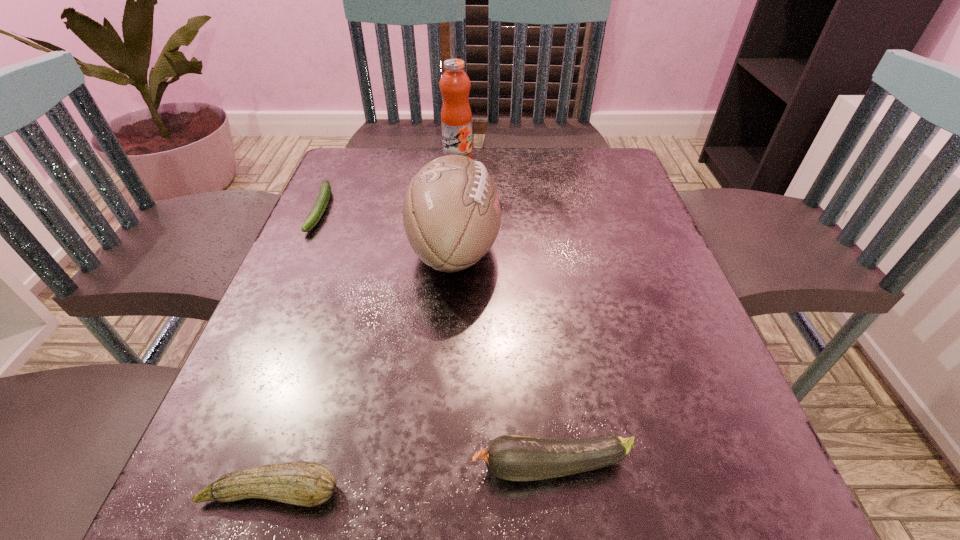
Where is `the third closest object to the farthest zucchini`? the third closest object to the farthest zucchini is located at coordinates (303, 483).

Select which zucchini appears as the closest to the rightmost zucchini. Please provide its 2D coordinates. Your answer should be formatted as a tuple, i.e. [(x, y)], where the tuple contains the x and y coordinates of a point satisfying the conditions above.

[(303, 483)]

Identify the location of the second closest zucchini to the farthest zucchini. pos(509,457).